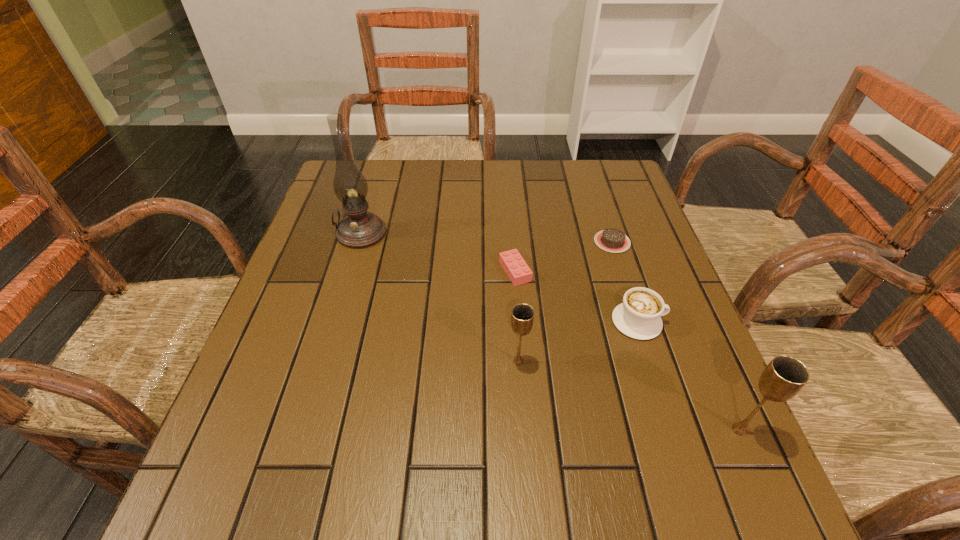
Please point a spot on the left to add another chalice. Please provide its 2D coordinates. Your answer should be formatted as a tuple, i.e. [(x, y)], where the tuple contains the x and y coordinates of a point satisfying the conditions above.

[(343, 307)]